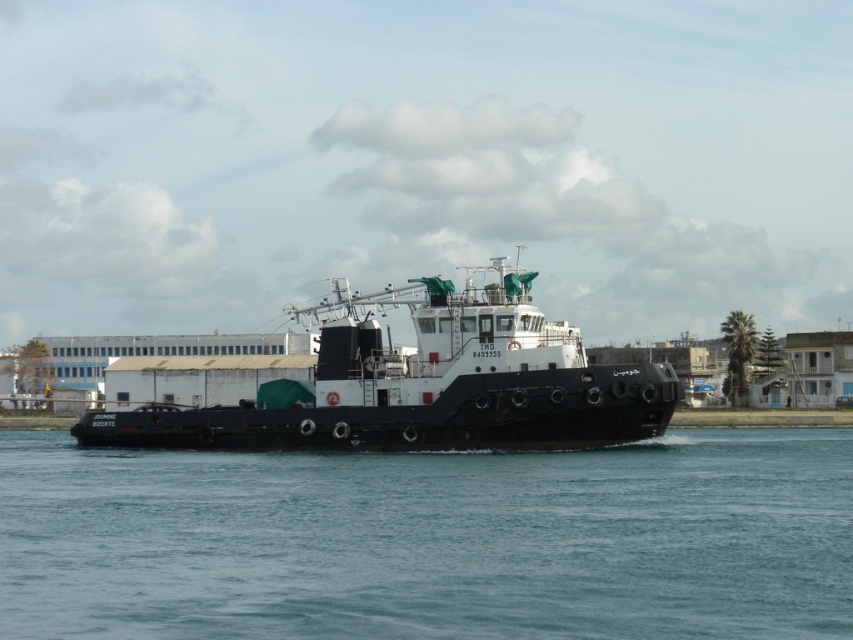
Question: Does clear blue water at center have a smaller size compared to black matte tugboat at center?

Choices:
 (A) no
 (B) yes

Answer: (B)

Question: Is clear blue water at center below black matte tugboat at center?

Choices:
 (A) yes
 (B) no

Answer: (A)

Question: Which of the following is the closest to the observer?

Choices:
 (A) (344, 432)
 (B) (305, 625)

Answer: (B)

Question: Does clear blue water at center appear over black matte tugboat at center?

Choices:
 (A) no
 (B) yes

Answer: (A)

Question: Which point appears closest to the camera in this image?

Choices:
 (A) (646, 611)
 (B) (322, 380)

Answer: (A)